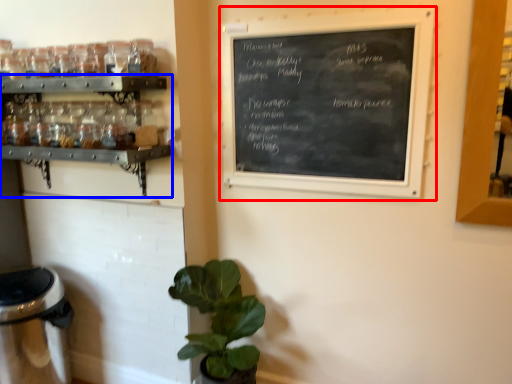
Question: Among these objects, which one is nearest to the camera, bulletin board (highlighted by a red box) or shelf (highlighted by a blue box)?

Choices:
 (A) bulletin board
 (B) shelf

Answer: (A)